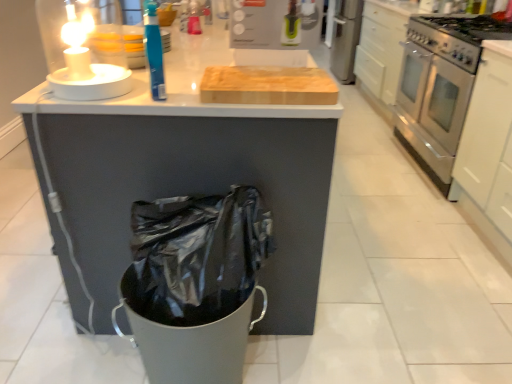
Question: In terms of width, does stainless steel oven at right look wider or thinner when compared to stainless steel gas stove at right?

Choices:
 (A) thin
 (B) wide

Answer: (A)

Question: From a real-world perspective, relative to stainless steel gas stove at right, is stainless steel oven at right vertically above or below?

Choices:
 (A) below
 (B) above

Answer: (A)

Question: Considering the real-world distances, which object is farthest from the white glossy candle holder at upper left?

Choices:
 (A) white matte cabinet at right
 (B) white glossy counter at center
 (C) blue plastic bottle at upper center
 (D) stainless steel gas stove at right
 (E) stainless steel oven at right

Answer: (E)

Question: Estimate the real-world distances between objects in this image. Which object is closer to the white glossy candle holder at upper left?

Choices:
 (A) white glossy counter at center
 (B) white glossy drawer at upper right
 (C) stainless steel gas stove at right
 (D) white matte cabinet at right
 (E) stainless steel oven at right

Answer: (A)